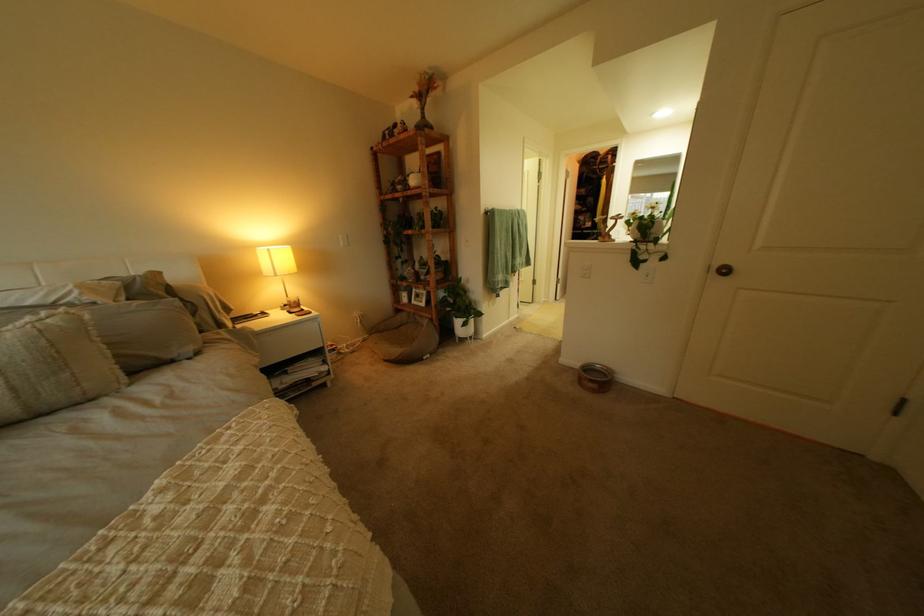
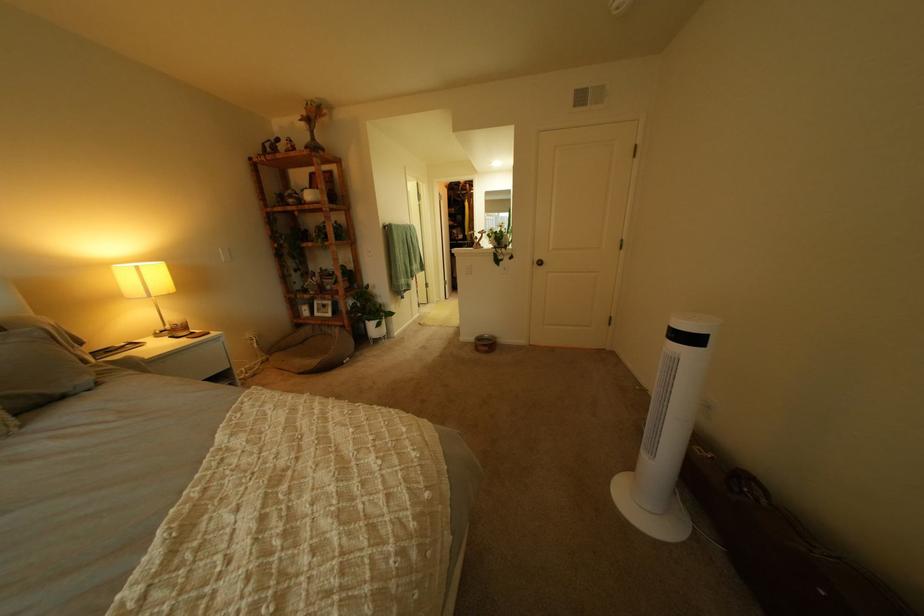
Question: How did the camera likely rotate?

Choices:
 (A) Left
 (B) Right
 (C) Up
 (D) Down

Answer: (B)